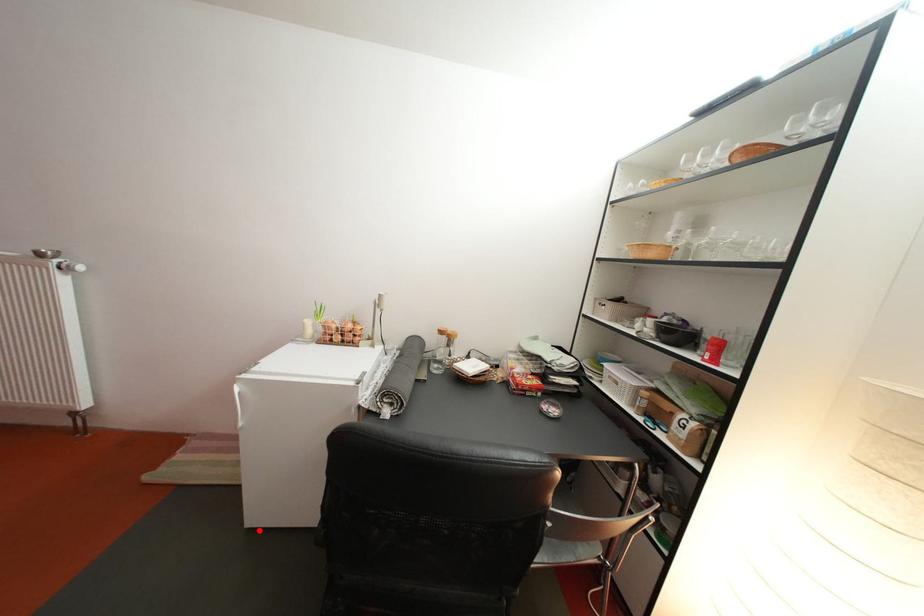
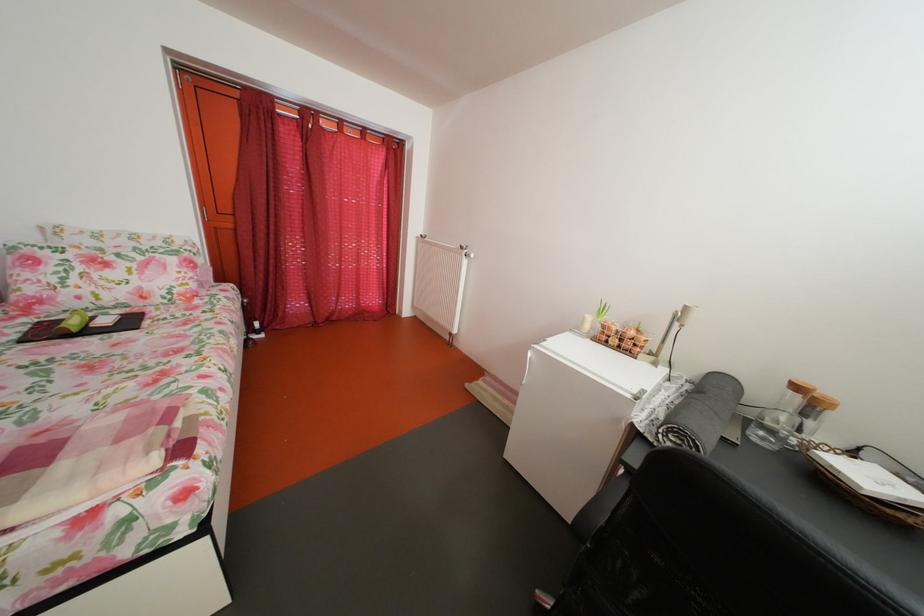
Question: I am providing you with two images of the same scene from different viewpoints. A red point is shown in image1. For the corresponding object point in image2, is it positioned nearer or farther from the camera?

Choices:
 (A) Nearer
 (B) Farther

Answer: (B)